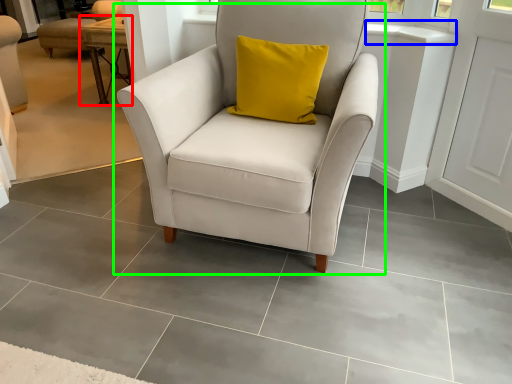
Question: Based on their relative distances, which object is nearer to table (highlighted by a red box)? Choose from window sill (highlighted by a blue box) and chair (highlighted by a green box).

Choices:
 (A) window sill
 (B) chair

Answer: (B)